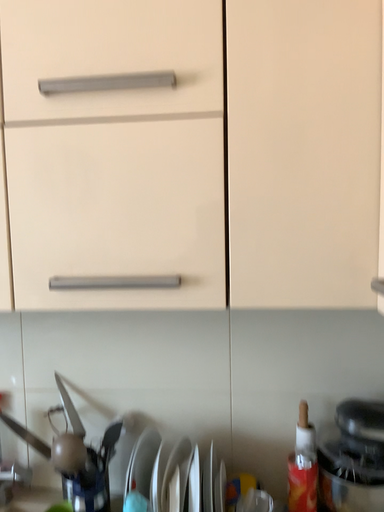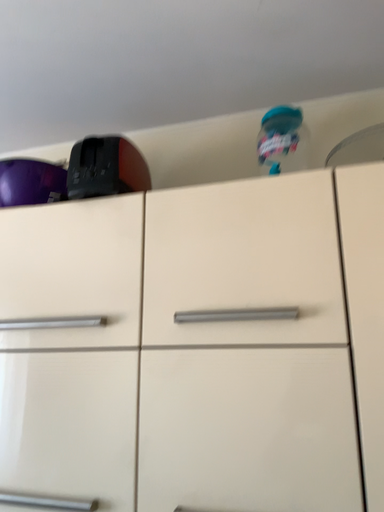
Question: How did the camera likely rotate when shooting the video?

Choices:
 (A) rotated downward
 (B) rotated upward

Answer: (B)